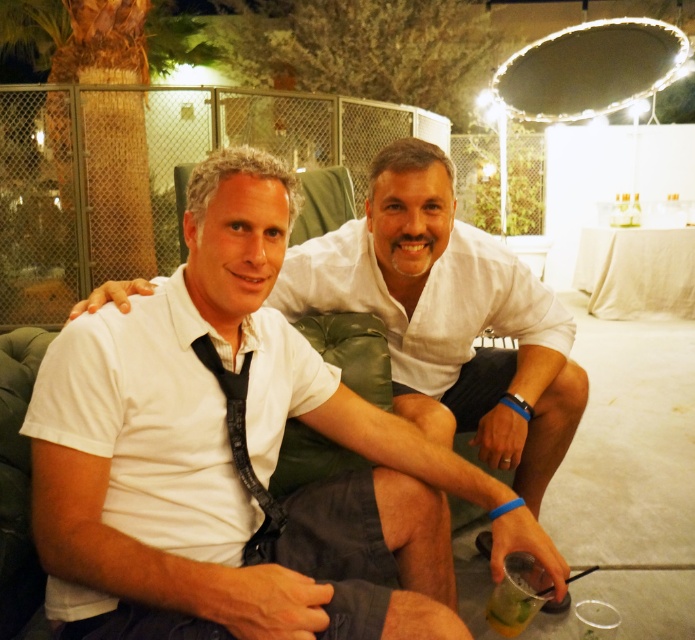
You are a photographer at the event and need to determine if the white cotton shirt at center can be used to cover the clear plastic cup at lower right without any part of the cup being visible. Based on their sizes, is this possible?

The white cotton shirt at center is larger in size than the clear plastic cup at lower right, so yes, it can fully cover the clear plastic cup at lower right without any part of the cup being visible.

You are a photographer at the event and need to quickly grab your water cup. You see the white cotton shirt at center and the clear plastic cup at lower right. Which object is closer to you?

The clear plastic cup at lower right is behind the white cotton shirt at center, so the white cotton shirt at center is closer to you.

Consider the image. You are taking a photo of two points in the scene. The first point is labeled as point (279, 284) and the second is point (514, 632). Which point is closer to the camera?

Point (514, 632) is closer to the camera than point (279, 284) because the description states that point (279, 284) is further away.